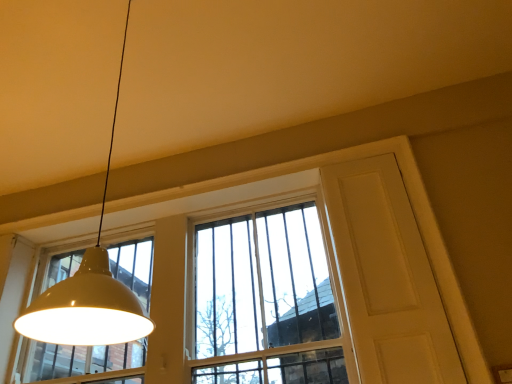
Question: Considering the positions of clear glass window at center and white glossy lampshade at upper left in the image, is clear glass window at center wider or thinner than white glossy lampshade at upper left?

Choices:
 (A) thin
 (B) wide

Answer: (A)

Question: Considering their positions, is clear glass window at center located in front of or behind white glossy lampshade at upper left?

Choices:
 (A) front
 (B) behind

Answer: (B)

Question: Which object is positioned closest to the white glossy lampshade at upper left?

Choices:
 (A) clear glass window at center
 (B) white matte screen door at upper right

Answer: (B)

Question: Which object is positioned closest to the white glossy lampshade at upper left?

Choices:
 (A) clear glass window at center
 (B) white matte screen door at upper right

Answer: (B)